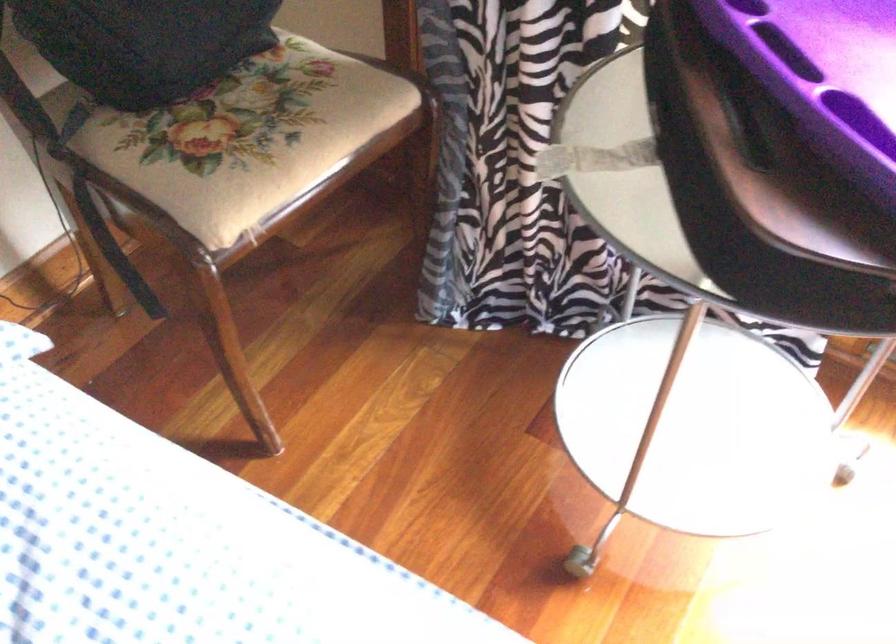
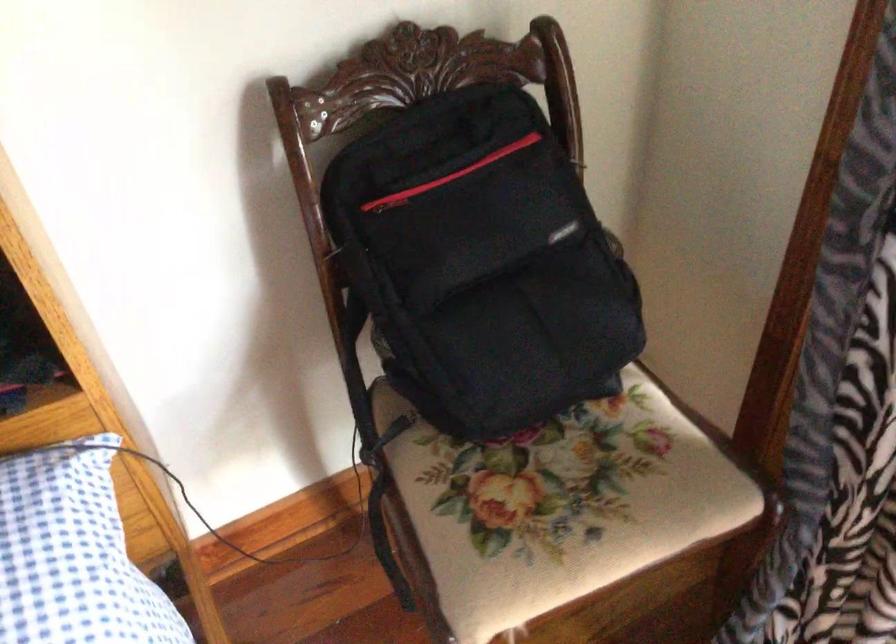
Question: The camera is either moving clockwise (left) or counter-clockwise (right) around the object. The first image is from the beginning of the video and the second image is from the end. Is the camera moving left or right when shooting the video?

Choices:
 (A) Left
 (B) Right

Answer: (B)